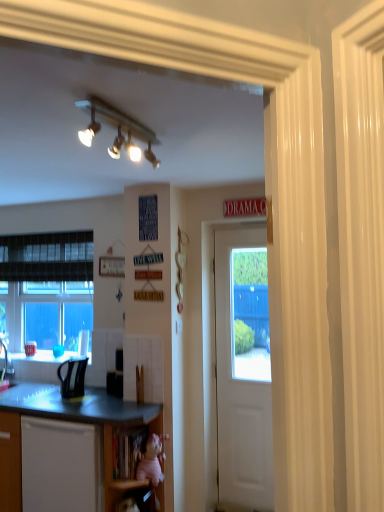
Locate an element on the screen. The width and height of the screenshot is (384, 512). free spot in front of matte black kettle at left is located at coordinates pyautogui.click(x=72, y=402).